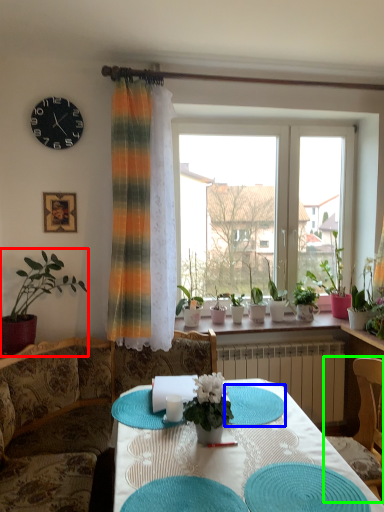
Question: Which is nearer to the houseplant (highlighted by a red box)? mat (highlighted by a blue box) or chair (highlighted by a green box).

Choices:
 (A) mat
 (B) chair

Answer: (A)